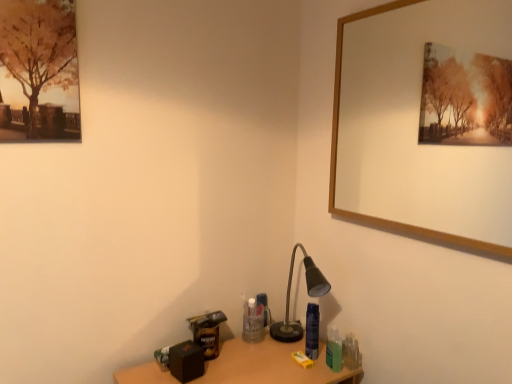
Question: Does matte black desk lamp at lower right have a lesser height compared to wooden table at lower center?

Choices:
 (A) no
 (B) yes

Answer: (A)

Question: Can wooden table at lower center be found inside matte black desk lamp at lower right?

Choices:
 (A) no
 (B) yes

Answer: (A)

Question: Is matte black desk lamp at lower right positioned far away from wooden table at lower center?

Choices:
 (A) yes
 (B) no

Answer: (B)

Question: Considering the relative positions of matte black desk lamp at lower right and wooden table at lower center in the image provided, is matte black desk lamp at lower right to the left of wooden table at lower center from the viewer's perspective?

Choices:
 (A) yes
 (B) no

Answer: (B)

Question: Is matte black desk lamp at lower right closer to the viewer compared to wooden table at lower center?

Choices:
 (A) yes
 (B) no

Answer: (B)

Question: From the image's perspective, is wooden picture frame at upper right above or below matte black desk lamp at lower right?

Choices:
 (A) above
 (B) below

Answer: (A)

Question: From a real-world perspective, relative to matte black desk lamp at lower right, is wooden picture frame at upper right vertically above or below?

Choices:
 (A) below
 (B) above

Answer: (B)

Question: Is wooden picture frame at upper right inside or outside of matte black desk lamp at lower right?

Choices:
 (A) inside
 (B) outside

Answer: (B)

Question: Considering the positions of wooden picture frame at upper right and matte black desk lamp at lower right in the image, is wooden picture frame at upper right taller or shorter than matte black desk lamp at lower right?

Choices:
 (A) short
 (B) tall

Answer: (B)

Question: From a real-world perspective, is matte black desk lamp at lower right positioned above or below wooden picture frame at upper right?

Choices:
 (A) below
 (B) above

Answer: (A)

Question: In terms of height, does matte black desk lamp at lower right look taller or shorter compared to wooden picture frame at upper right?

Choices:
 (A) short
 (B) tall

Answer: (A)

Question: From the image's perspective, relative to wooden picture frame at upper right, is matte black desk lamp at lower right above or below?

Choices:
 (A) above
 (B) below

Answer: (B)

Question: Looking at the image, does matte black desk lamp at lower right seem bigger or smaller compared to wooden picture frame at upper right?

Choices:
 (A) big
 (B) small

Answer: (B)

Question: Considering the positions of point (327, 380) and point (501, 226), is point (327, 380) closer or farther from the camera than point (501, 226)?

Choices:
 (A) closer
 (B) farther

Answer: (A)

Question: From the image's perspective, relative to wooden picture frame at upper right, is wooden table at lower center above or below?

Choices:
 (A) below
 (B) above

Answer: (A)